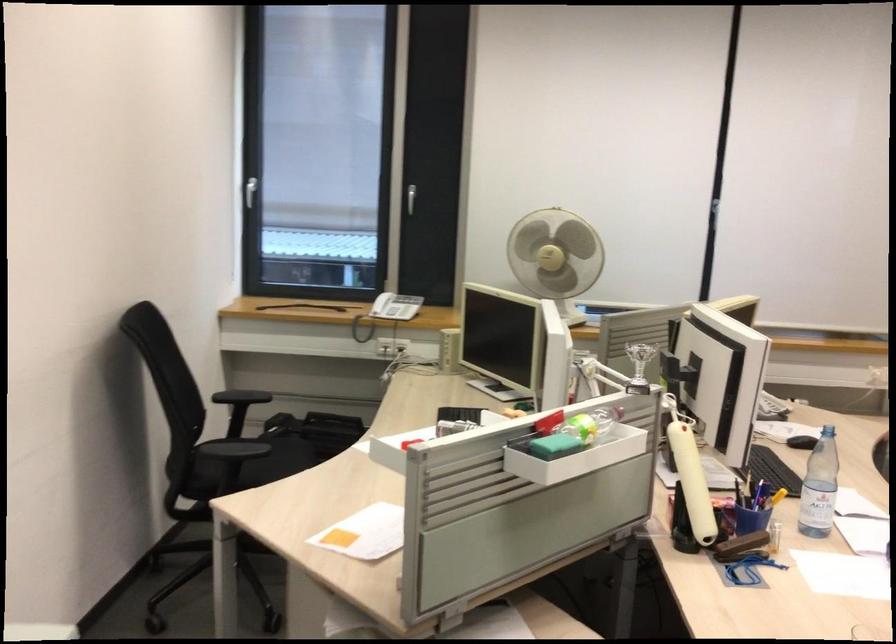
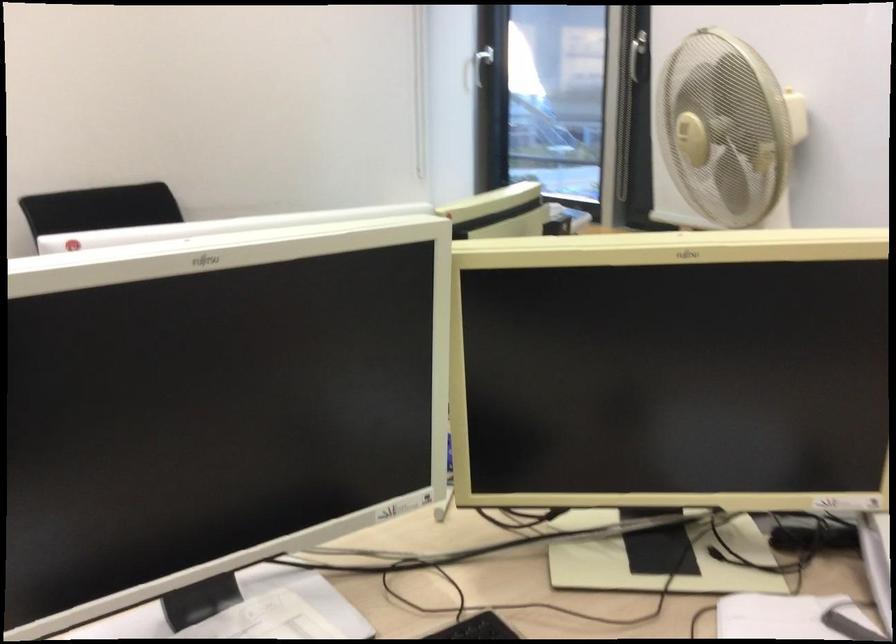
Where in the second image is the point corresponding to [227,187] from the first image?

(476, 69)